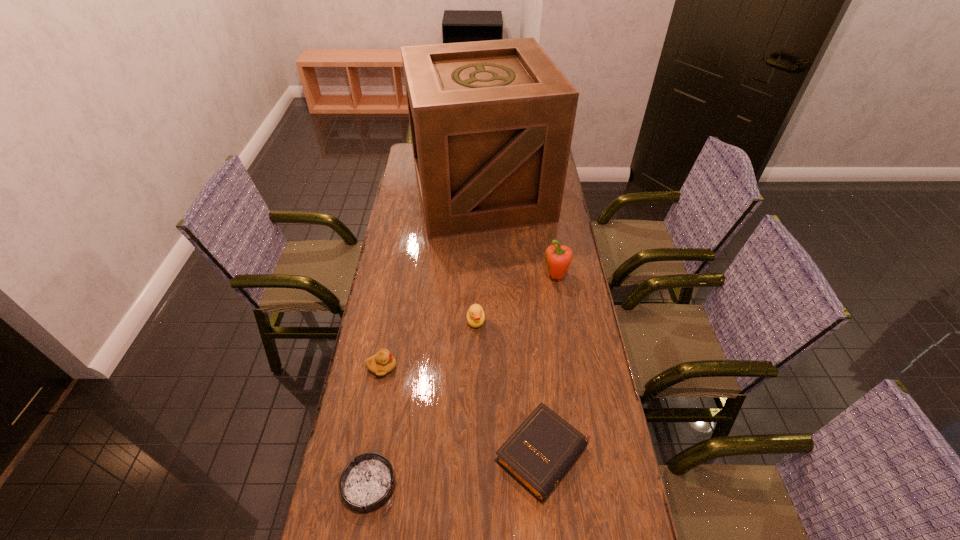
Where is `box positioned at the right edge`? This screenshot has width=960, height=540. box positioned at the right edge is located at coordinates (491, 122).

Identify the location of pepper that is at the right edge. (558, 258).

You are a GUI agent. You are given a task and a screenshot of the screen. Output one action in this format:
    pyautogui.click(x=<x>, y=<y>)
    Task: Click on the Bible that is at the right edge
    Image resolution: width=960 pixels, height=540 pixels.
    Given the screenshot: What is the action you would take?
    pyautogui.click(x=542, y=449)

Identify the location of object that is at the far left corner. This screenshot has height=540, width=960. (491, 122).

You are a GUI agent. You are given a task and a screenshot of the screen. Output one action in this format:
    pyautogui.click(x=<x>, y=<y>)
    Task: Click on the object situated at the far right corner
    
    Given the screenshot: What is the action you would take?
    pyautogui.click(x=491, y=122)

Locate an element on the screen. free region at the left edge of the desktop is located at coordinates (409, 366).

Locate an element on the screen. Image resolution: width=960 pixels, height=540 pixels. vacant position at the right edge of the desktop is located at coordinates (575, 284).

I want to click on free space between the fifth shortest object and the fourth nearest object, so click(x=516, y=299).

At what (x,y) coordinates should I click in order to perform the action: click on vacant point located between the fourth nearest object and the shortest object. Please return your answer as a coordinate pair (x, y). Looking at the image, I should click on (422, 403).

Locate an element on the screen. Image resolution: width=960 pixels, height=540 pixels. vacant region between the fifth nearest object and the right duckling is located at coordinates (516, 299).